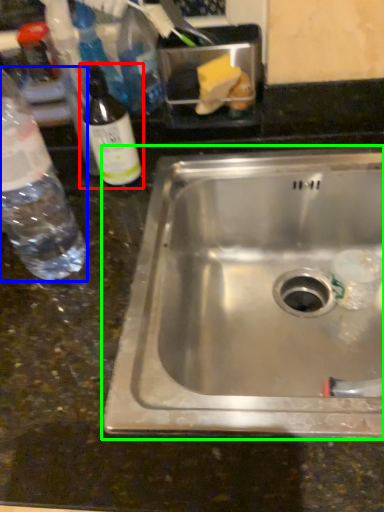
Question: Based on their relative distances, which object is farther from bottle (highlighted by a red box)? Choose from bottle (highlighted by a blue box) and sink (highlighted by a green box).

Choices:
 (A) bottle
 (B) sink

Answer: (B)